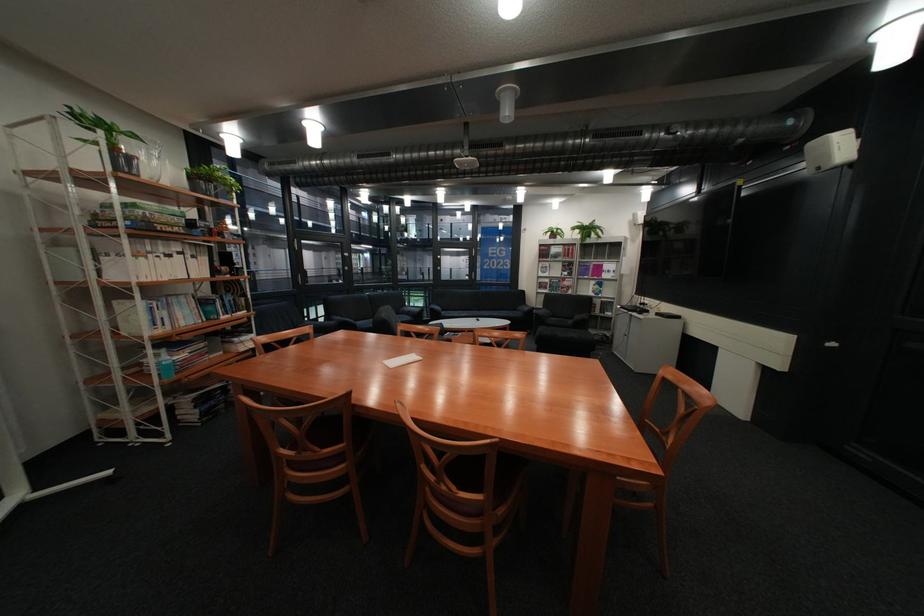
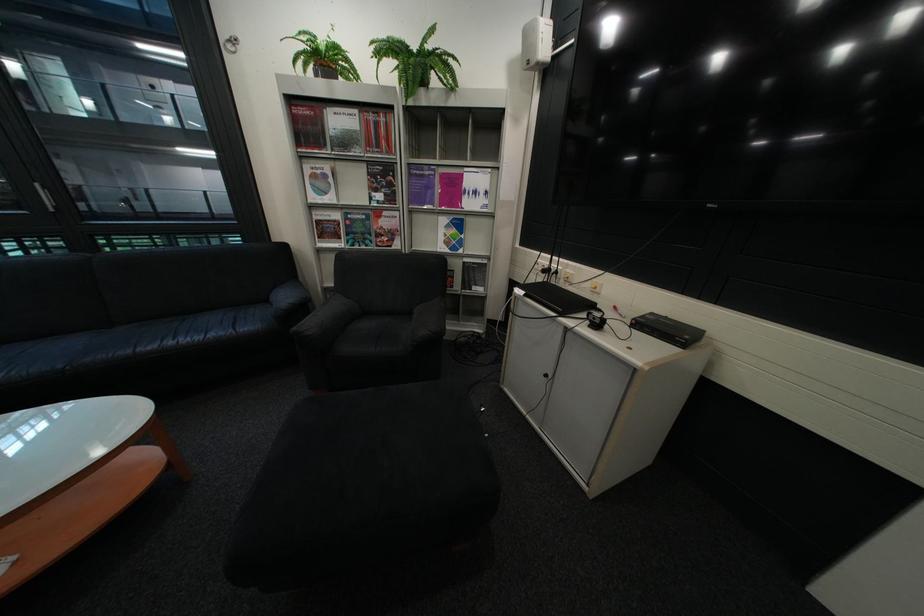
Find the pixel in the second image that matches [621,276] in the first image.

(484, 204)